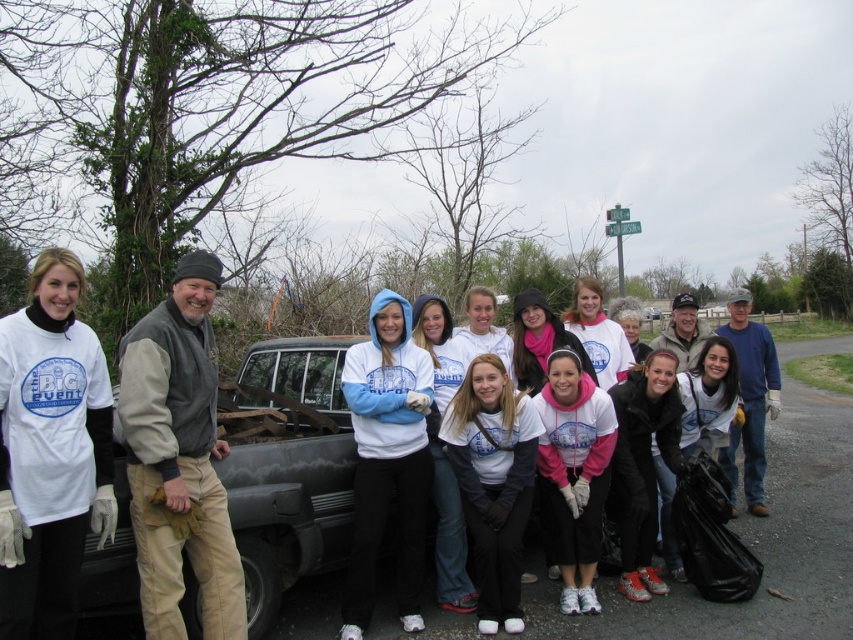
Between point (93, 440) and point (178, 349), which one is positioned behind?

Point (178, 349)

Identify the location of white cotton t-shirt at center. The image size is (853, 640). (50, 452).